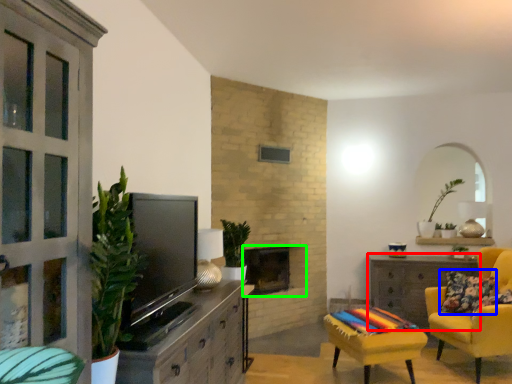
Question: Which object is the closest to the desk (highlighted by a red box)? Choose among these: pillow (highlighted by a blue box) or fireplace (highlighted by a green box).

Choices:
 (A) pillow
 (B) fireplace

Answer: (A)